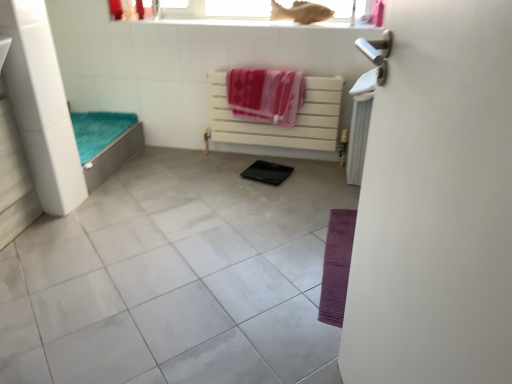
Find the location of a particular element. The width and height of the screenshot is (512, 384). blank space situated above white plastic radiator at center (from a real-world perspective) is located at coordinates (284, 67).